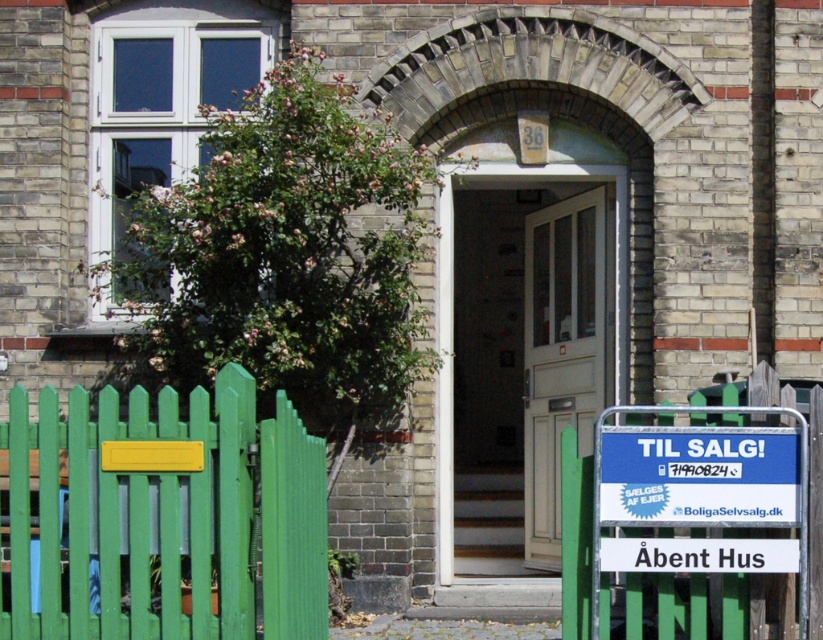
Question: Among these objects, which one is nearest to the camera?

Choices:
 (A) white wooden door at center
 (B) white glass door at center

Answer: (A)

Question: Does green wooden fence at lower left come behind green wooden fence at lower center?

Choices:
 (A) no
 (B) yes

Answer: (A)

Question: Which of these objects is positioned farthest from the green wooden fence at lower center?

Choices:
 (A) green wooden fence at lower left
 (B) white wooden door at center
 (C) blue plastic sign at center

Answer: (B)

Question: Which object is positioned closest to the blue plastic sign at center?

Choices:
 (A) white glass door at center
 (B) white wooden door at center
 (C) green wooden fence at lower center

Answer: (C)

Question: Can you confirm if green wooden fence at lower left is bigger than white wooden door at center?

Choices:
 (A) yes
 (B) no

Answer: (A)

Question: Observing the image, what is the correct spatial positioning of green wooden fence at lower center in reference to white glass door at center?

Choices:
 (A) below
 (B) above

Answer: (A)